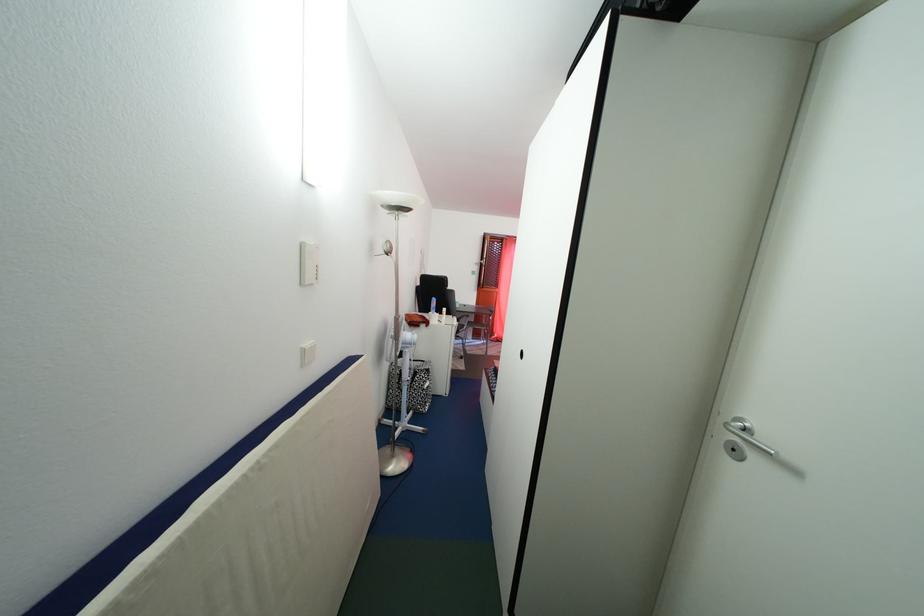
Describe the element at coordinates (308, 353) in the screenshot. I see `the intercom buttons` at that location.